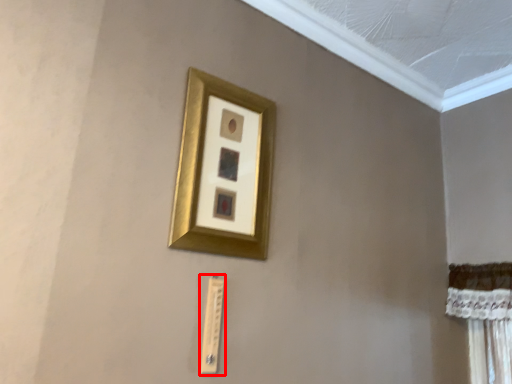
Question: From the image's perspective, where is light switch (annotated by the red box) located in relation to picture frame in the image?

Choices:
 (A) above
 (B) below

Answer: (B)